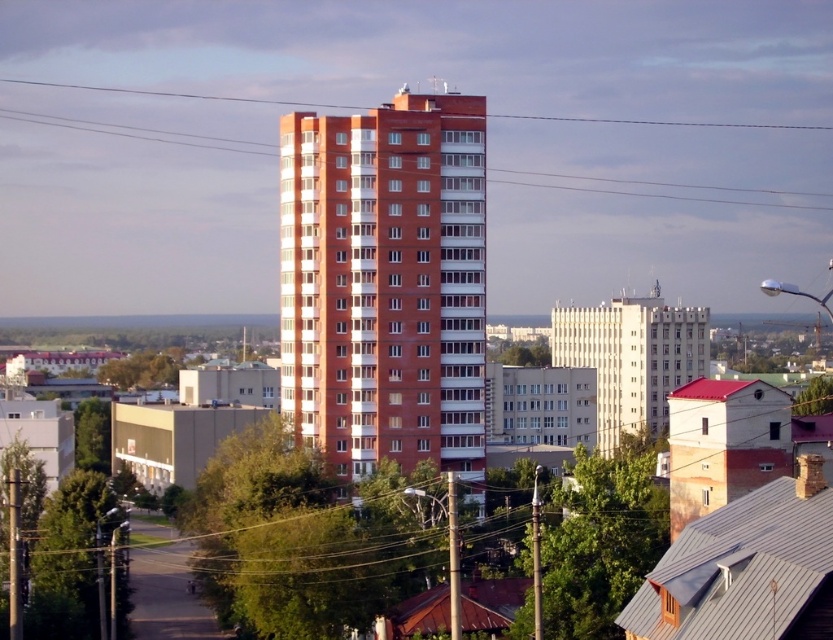
This screenshot has height=640, width=833. What do you see at coordinates (385, 284) in the screenshot? I see `brick building at center` at bounding box center [385, 284].

Measure the distance between point (434,440) and camera.

The distance of point (434,440) from camera is 154.79 meters.

The image size is (833, 640). I want to click on brick building at center, so click(385, 284).